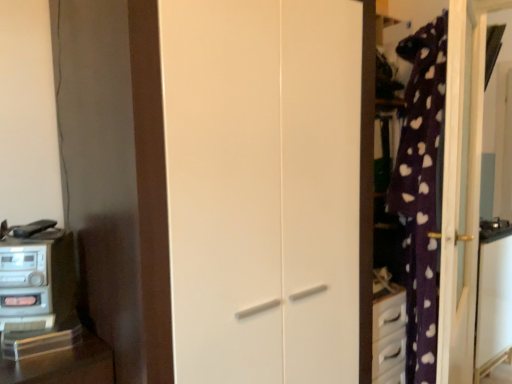
Question: Is white matte door at center oriented away from metallic silver stereo at left?

Choices:
 (A) no
 (B) yes

Answer: (A)

Question: Does white matte door at center have a smaller size compared to metallic silver stereo at left?

Choices:
 (A) no
 (B) yes

Answer: (A)

Question: Can you confirm if white matte door at center is thinner than metallic silver stereo at left?

Choices:
 (A) no
 (B) yes

Answer: (A)

Question: Is white matte door at center wider than metallic silver stereo at left?

Choices:
 (A) yes
 (B) no

Answer: (A)

Question: From the image's perspective, would you say white matte door at center is shown under metallic silver stereo at left?

Choices:
 (A) no
 (B) yes

Answer: (A)

Question: Considering the relative sizes of white matte door at center and metallic silver stereo at left in the image provided, is white matte door at center bigger than metallic silver stereo at left?

Choices:
 (A) no
 (B) yes

Answer: (B)

Question: Can you confirm if metallic silver stereo at left is thinner than white matte door at center?

Choices:
 (A) no
 (B) yes

Answer: (B)

Question: Is metallic silver stereo at left looking in the opposite direction of white matte door at center?

Choices:
 (A) yes
 (B) no

Answer: (A)

Question: From a real-world perspective, is metallic silver stereo at left on white matte door at center?

Choices:
 (A) yes
 (B) no

Answer: (B)

Question: From the image's perspective, does metallic silver stereo at left appear lower than white matte door at center?

Choices:
 (A) yes
 (B) no

Answer: (A)

Question: Is metallic silver stereo at left directly adjacent to white matte door at center?

Choices:
 (A) yes
 (B) no

Answer: (B)

Question: Does metallic silver stereo at left have a smaller size compared to white matte door at center?

Choices:
 (A) no
 (B) yes

Answer: (B)

Question: From a real-world perspective, is white matte door at center positioned above or below metallic silver stereo at left?

Choices:
 (A) below
 (B) above

Answer: (B)